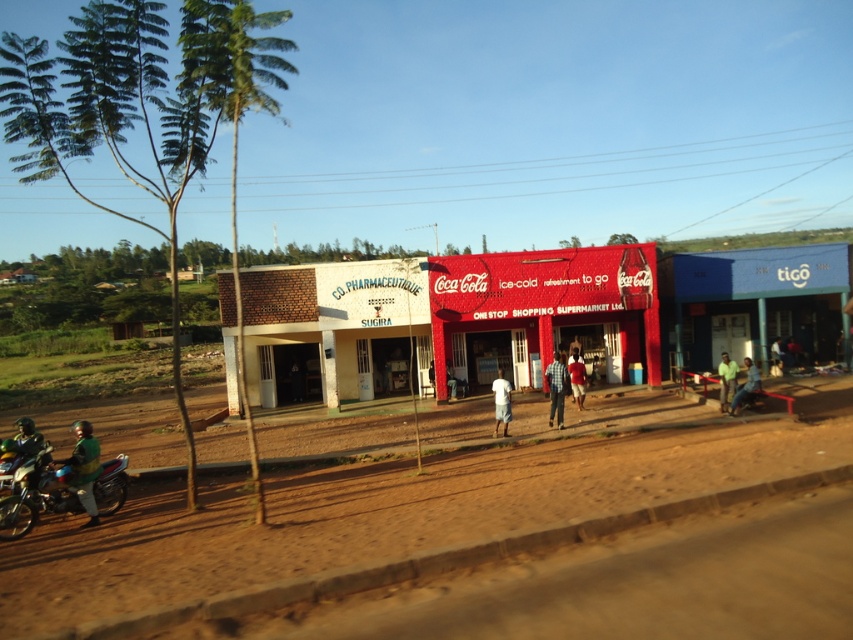
Question: Is red matte coca-cola sign at center to the right of matte red shirt at center from the viewer's perspective?

Choices:
 (A) no
 (B) yes

Answer: (A)

Question: Is brown sandy dirt field at lower center below shiny metallic motorbike at lower left?

Choices:
 (A) no
 (B) yes

Answer: (A)

Question: Among these points, which one is farthest from the camera?

Choices:
 (A) (572, 353)
 (B) (192, 10)

Answer: (A)

Question: Which object appears closest to the camera in this image?

Choices:
 (A) green fabric shirt at right
 (B) green leafy palm tree at left

Answer: (B)

Question: Which object is the closest to the green fabric shirt at lower right?

Choices:
 (A) shiny metallic motorbike at lower left
 (B) green leafy palm tree at left

Answer: (A)

Question: Observing the image, what is the correct spatial positioning of green leafy palm tree at left in reference to matte red shirt at center?

Choices:
 (A) right
 (B) left

Answer: (B)